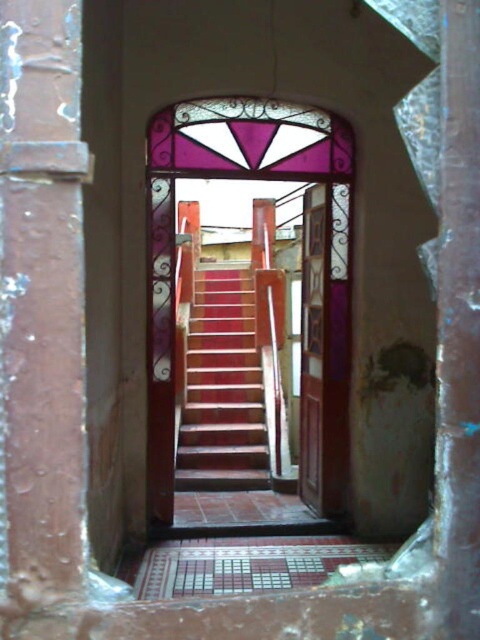
Is point (75, 339) farther from viewer compared to point (313, 196)?

No, it is in front of (313, 196).

Who is positioned more to the left, rusty metal pillar at left or wooden door at center?

From the viewer's perspective, rusty metal pillar at left appears more on the left side.

Image resolution: width=480 pixels, height=640 pixels. Describe the element at coordinates (41, 298) in the screenshot. I see `rusty metal pillar at left` at that location.

Where is `rusty metal pillar at left`? The width and height of the screenshot is (480, 640). rusty metal pillar at left is located at coordinates (41, 298).

Is wooden stairs at center thinner than wooden door at center?

No, wooden stairs at center is not thinner than wooden door at center.

Is point (179, 486) positioned in front of point (319, 483)?

No, (179, 486) is further to viewer.

Image resolution: width=480 pixels, height=640 pixels. Find the location of `wooden stairs at center`. wooden stairs at center is located at coordinates (223, 390).

Which is behind, point (304, 400) or point (314, 451)?

Point (304, 400)

Can you confirm if translucent stained glass at center is positioned above wooden door at center?

Yes, translucent stained glass at center is above wooden door at center.

Who is more distant from viewer, [165,204] or [313,250]?

The point [313,250] is behind.

Where is `translucent stained glass at center`? This screenshot has width=480, height=640. translucent stained glass at center is located at coordinates (300, 268).